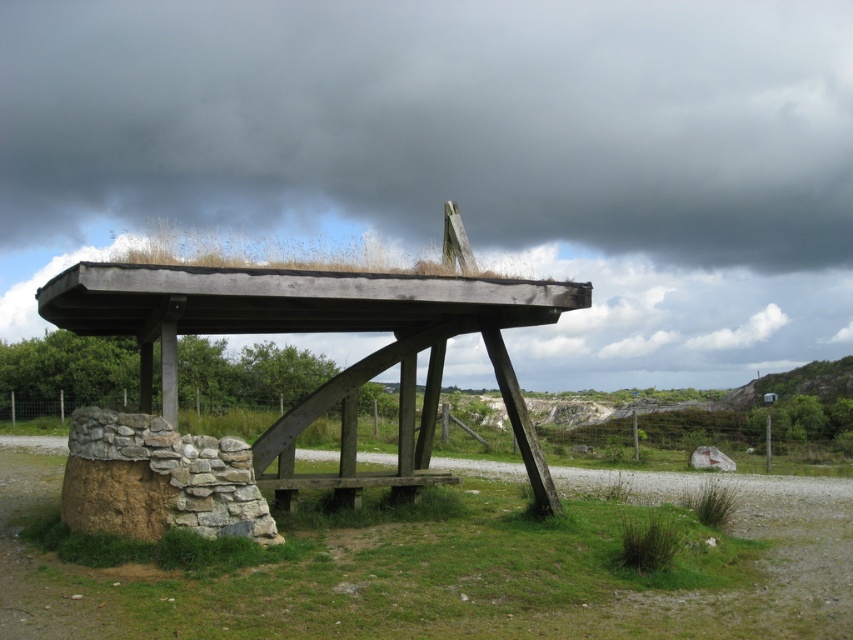
Is wooden gazebo at center bigger than brown wooden bench at center?

Yes.

Is the position of wooden gazebo at center less distant than that of brown wooden bench at center?

That is True.

At what (x,y) coordinates should I click in order to perform the action: click on wooden gazebo at center. Please return your answer as a coordinate pair (x, y). The width and height of the screenshot is (853, 640). Looking at the image, I should click on (321, 330).